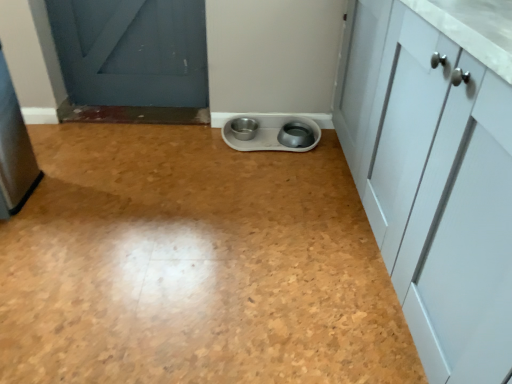
You are a GUI agent. You are given a task and a screenshot of the screen. Output one action in this format:
    pyautogui.click(x=<x>, y=<y>)
    Task: Click on the free space to the left of metallic gray bowls at center, positioned as the 2th appliance in front-to-back order
    
    Given the screenshot: What is the action you would take?
    pyautogui.click(x=194, y=145)